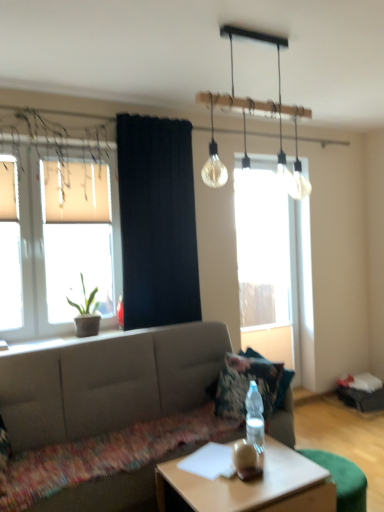
In order to click on transparent glass window at center, the 1th window in the right-to-left sequence in this screenshot , I will do `click(273, 261)`.

Based on the photo, in order to face black fabric curtain at center, should I rotate leftwards or rightwards?

Rotate your view left by about 3.911°.

In order to face translucent glass window at left, the 1th window when ordered from front to back, should I rotate leftwards or rightwards?

Turn left approximately 16.926 degrees to face it.

What is the approximate height of translucent glass window at left, placed as the 2th window when sorted from right to left?

translucent glass window at left, placed as the 2th window when sorted from right to left, is 1.43 meters tall.

The image size is (384, 512). What do you see at coordinates (251, 486) in the screenshot? I see `wooden desk at center` at bounding box center [251, 486].

The height and width of the screenshot is (512, 384). Describe the element at coordinates (86, 313) in the screenshot. I see `green matte plant at left` at that location.

This screenshot has height=512, width=384. Find the location of `matte gray couch at center`. matte gray couch at center is located at coordinates (108, 382).

In the scene shown: Does wooden desk at center come behind black fabric curtain at center?

No, wooden desk at center is closer to the viewer.

Is wooden desk at center touching black fabric curtain at center?

wooden desk at center and black fabric curtain at center are clearly separated.

Consider the image. Is wooden desk at center wider than black fabric curtain at center?

Yes, wooden desk at center is wider than black fabric curtain at center.

Where is `curtain lying behind the wooden desk at center`? curtain lying behind the wooden desk at center is located at coordinates (157, 221).

Is wooden desk at center behind matte gray couch at center?

No, wooden desk at center is in front of matte gray couch at center.

Can you confirm if wooden desk at center is taller than matte gray couch at center?

No, wooden desk at center is not taller than matte gray couch at center.

Who is smaller, wooden desk at center or matte gray couch at center?

With smaller size is wooden desk at center.

Is wooden desk at center looking in the opposite direction of matte gray couch at center?

Yes, wooden desk at center is facing away from matte gray couch at center.

From the image's perspective, would you say matte gray couch at center is shown under transparent glass window at center, the 2th window viewed from the front?

Yes, from the image's perspective, matte gray couch at center is below transparent glass window at center, the 2th window viewed from the front.

Is transparent glass window at center, which is the first window from back to front, surrounded by matte gray couch at center?

No, transparent glass window at center, which is the first window from back to front, is not inside matte gray couch at center.

Is matte gray couch at center facing away from transparent glass window at center, the 1th window in the right-to-left sequence?

No, matte gray couch at center is not facing away from transparent glass window at center, the 1th window in the right-to-left sequence.

Choose the correct answer: Is transparent glass window at center, the second window when ordered from left to right, inside green matte plant at left or outside it?

transparent glass window at center, the second window when ordered from left to right, is located beyond the bounds of green matte plant at left.

Is point (278, 287) in front of point (84, 322)?

No.

Can you confirm if transparent glass window at center, which is the first window from back to front, is positioned to the left of green matte plant at left?

No, transparent glass window at center, which is the first window from back to front, is not to the left of green matte plant at left.

Which of these two, matte gray couch at center or green matte plant at left, is bigger?

matte gray couch at center.

From their relative heights in the image, would you say matte gray couch at center is taller or shorter than green matte plant at left?

In the image, matte gray couch at center appears to be taller than green matte plant at left.

Does point (47, 386) come farther from viewer compared to point (87, 334)?

No, it is in front of (87, 334).

Are matte gray couch at center and green matte plant at left beside each other?

matte gray couch at center is not next to green matte plant at left, and they're not touching.

The width and height of the screenshot is (384, 512). Find the location of `curtain that is behind the matte gray couch at center`. curtain that is behind the matte gray couch at center is located at coordinates (157, 221).

Is matte gray couch at center behind black fabric curtain at center?

No, matte gray couch at center is closer to the viewer.

How distant is matte gray couch at center from black fabric curtain at center?

matte gray couch at center is 28.77 inches from black fabric curtain at center.

Is black fabric curtain at center inside matte gray couch at center?

Definitely not — black fabric curtain at center is not inside matte gray couch at center.

Is green matte plant at left in contact with transparent glass window at center, the 1th window in the right-to-left sequence?

No, green matte plant at left is not with transparent glass window at center, the 1th window in the right-to-left sequence.

Considering the sizes of objects green matte plant at left and transparent glass window at center, the 1th window in the right-to-left sequence, in the image provided, who is shorter, green matte plant at left or transparent glass window at center, the 1th window in the right-to-left sequence,?

green matte plant at left.

Between green matte plant at left and transparent glass window at center, the second window when ordered from left to right, which one appears on the left side from the viewer's perspective?

Positioned to the left is green matte plant at left.

Identify the location of curtain that is behind the wooden desk at center. (157, 221).

The image size is (384, 512). Identify the location of desk that appears below the matte gray couch at center (from a real-world perspective). (251, 486).

When comparing their distances from translucent glass light fixture at upper center, does clear plastic bottle at center or matte gray couch at center seem closer?

clear plastic bottle at center is positioned closer to the anchor translucent glass light fixture at upper center.

Based on their spatial positions, is wooden desk at center or green matte plant at left closer to translucent glass light fixture at upper center?

The object closer to translucent glass light fixture at upper center is green matte plant at left.

Considering their positions, is matte gray couch at center positioned closer to wooden desk at center than black fabric curtain at center?

Among the two, matte gray couch at center is located nearer to wooden desk at center.

Which object lies further to the anchor point transparent glass window at center, the 1th window in the right-to-left sequence, matte gray couch at center or translucent glass light fixture at upper center?

The object further to transparent glass window at center, the 1th window in the right-to-left sequence, is translucent glass light fixture at upper center.

Looking at the image, which one is located closer to black fabric curtain at center, green matte plant at left or transparent glass window at center, which is the first window from back to front?

green matte plant at left is positioned closer to the anchor black fabric curtain at center.

Considering their positions, is green matte plant at left positioned further to translucent glass window at left, the first window viewed from the left, than black fabric curtain at center?

black fabric curtain at center is positioned further to the anchor translucent glass window at left, the first window viewed from the left.

Considering their positions, is transparent glass window at center, the 1th window in the right-to-left sequence, positioned further to matte gray couch at center than translucent glass light fixture at upper center?

translucent glass light fixture at upper center is further to matte gray couch at center.

Based on their spatial positions, is wooden desk at center or translucent glass light fixture at upper center further from transparent glass window at center, the 1th window in the right-to-left sequence?

translucent glass light fixture at upper center is further to transparent glass window at center, the 1th window in the right-to-left sequence.

I want to click on curtain between translucent glass light fixture at upper center and matte gray couch at center in the up-down direction, so click(157, 221).

Locate an element on the screen. Image resolution: width=384 pixels, height=512 pixels. bottle positioned between matte gray couch at center and transparent glass window at center, the 2th window viewed from the front, from near to far is located at coordinates (255, 418).

Identify the location of bottle between wooden desk at center and green matte plant at left along the z-axis. (255, 418).

This screenshot has height=512, width=384. What are the coordinates of `bottle between translucent glass window at left, which ranks as the second window in back-to-front order, and transparent glass window at center, which is the first window from back to front, from left to right` in the screenshot? It's located at (255, 418).